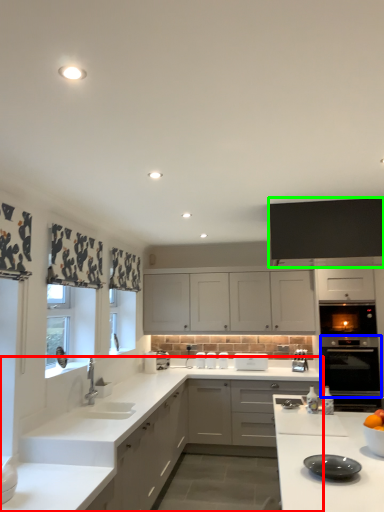
Question: Based on their relative distances, which object is farther from countertop (highlighted by a red box)? Choose from oven (highlighted by a blue box) and cabinetry (highlighted by a green box).

Choices:
 (A) oven
 (B) cabinetry

Answer: (A)